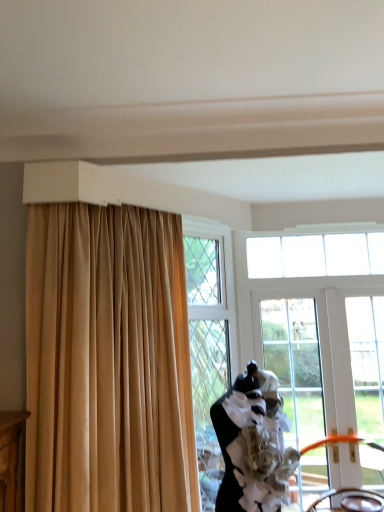
Question: In the image, is orange plastic chair at lower right, which ranks as the 2th chair in front-to-back order, on the left side or the right side of clear glass door at center?

Choices:
 (A) left
 (B) right

Answer: (B)

Question: Which is correct: orange plastic chair at lower right, the first chair when ordered from back to front, is inside clear glass door at center, or outside of it?

Choices:
 (A) inside
 (B) outside

Answer: (A)

Question: Which is nearer to the black matte dress form at center?

Choices:
 (A) brown leather chair at lower right, the first chair from the front
 (B) clear glass door at center
 (C) beige fabric curtain at upper left
 (D) orange plastic chair at lower right, the first chair when ordered from back to front
 (E) clear glass window at upper center, arranged as the 1th window when viewed from the top

Answer: (C)

Question: Which is farther from the white plastic door at right, which is the second window in top-to-bottom order?

Choices:
 (A) brown leather chair at lower right, the 2th chair in the back-to-front sequence
 (B) orange plastic chair at lower right, the first chair when ordered from back to front
 (C) beige fabric curtain at upper left
 (D) clear glass window at upper center, which appears as the second window when ordered from the bottom
 (E) clear glass door at center

Answer: (C)